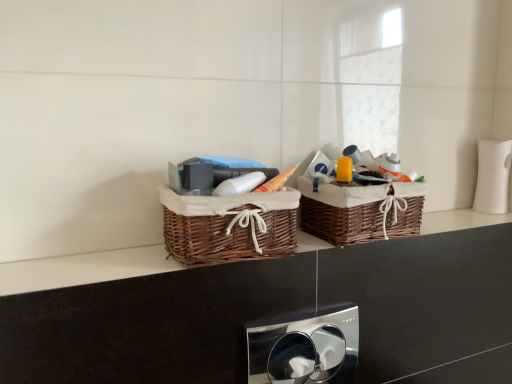
Question: Are woven brown basket at center, which is the first picnic basket in left-to-right order, and chrome metallic flush plate at center far apart?

Choices:
 (A) no
 (B) yes

Answer: (A)

Question: Considering the relative positions of woven brown basket at center, which appears as the 2th picnic basket when viewed from the right, and chrome metallic flush plate at center in the image provided, is woven brown basket at center, which appears as the 2th picnic basket when viewed from the right, to the left of chrome metallic flush plate at center from the viewer's perspective?

Choices:
 (A) no
 (B) yes

Answer: (B)

Question: Is woven brown basket at center, which appears as the 2th picnic basket when viewed from the right, shorter than chrome metallic flush plate at center?

Choices:
 (A) no
 (B) yes

Answer: (B)

Question: Is chrome metallic flush plate at center located within woven brown basket at center, which appears as the 2th picnic basket when viewed from the right?

Choices:
 (A) yes
 (B) no

Answer: (B)

Question: From a real-world perspective, is woven brown basket at center, which appears as the 2th picnic basket when viewed from the right, positioned under chrome metallic flush plate at center based on gravity?

Choices:
 (A) no
 (B) yes

Answer: (A)

Question: From the image's perspective, is woven brown basket at center, which is the first picnic basket in left-to-right order, above chrome metallic flush plate at center?

Choices:
 (A) yes
 (B) no

Answer: (A)

Question: Does brown wicker baskets at center have a greater width compared to woven brown basket at center, which appears as the 2th picnic basket when viewed from the right?

Choices:
 (A) no
 (B) yes

Answer: (A)

Question: Can you confirm if brown wicker baskets at center is taller than woven brown basket at center, which is the first picnic basket in left-to-right order?

Choices:
 (A) no
 (B) yes

Answer: (A)

Question: From a real-world perspective, does brown wicker baskets at center sit lower than woven brown basket at center, which is the first picnic basket in left-to-right order?

Choices:
 (A) yes
 (B) no

Answer: (A)

Question: Does brown wicker baskets at center appear on the right side of woven brown basket at center, which appears as the 2th picnic basket when viewed from the right?

Choices:
 (A) yes
 (B) no

Answer: (A)

Question: From the image's perspective, is brown wicker baskets at center under woven brown basket at center, which is the first picnic basket in left-to-right order?

Choices:
 (A) yes
 (B) no

Answer: (A)

Question: Does brown wicker baskets at center have a larger size compared to woven brown basket at center, which appears as the 2th picnic basket when viewed from the right?

Choices:
 (A) yes
 (B) no

Answer: (B)

Question: Is brown wicker baskets at center further to the viewer compared to woven brown basket at center, which is the 1th picnic basket in right-to-left order?

Choices:
 (A) no
 (B) yes

Answer: (A)